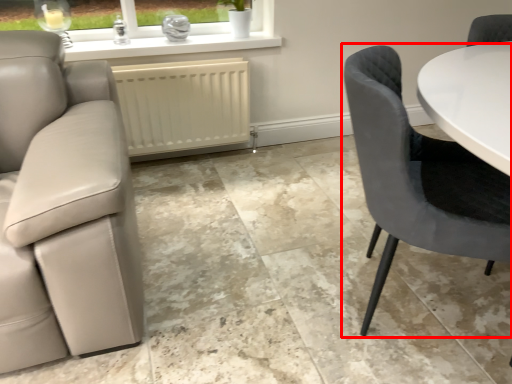
Question: From the image's perspective, where is chair (annotated by the red box) located relative to radiator?

Choices:
 (A) above
 (B) below

Answer: (B)